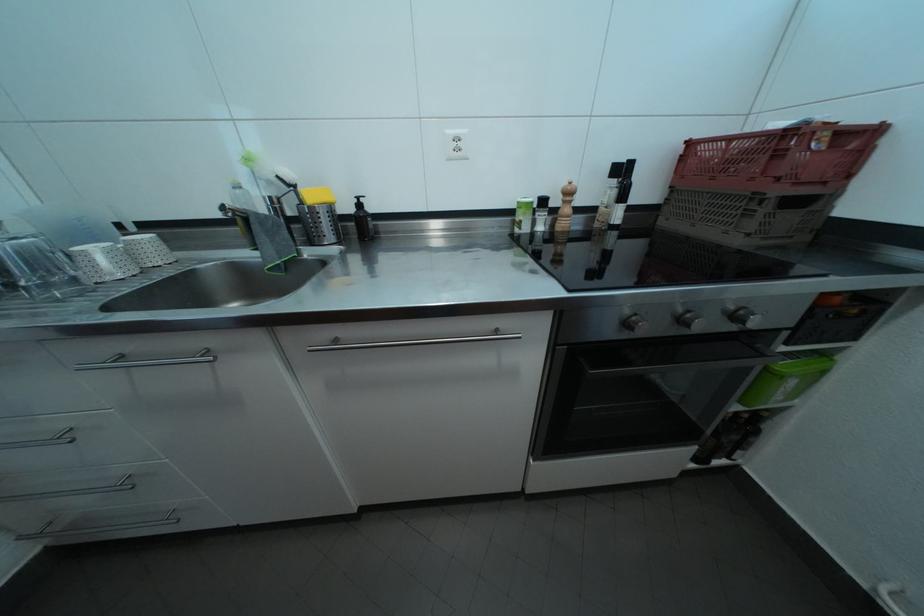
Describe the element at coordinates (671, 358) in the screenshot. I see `a oven door handle` at that location.